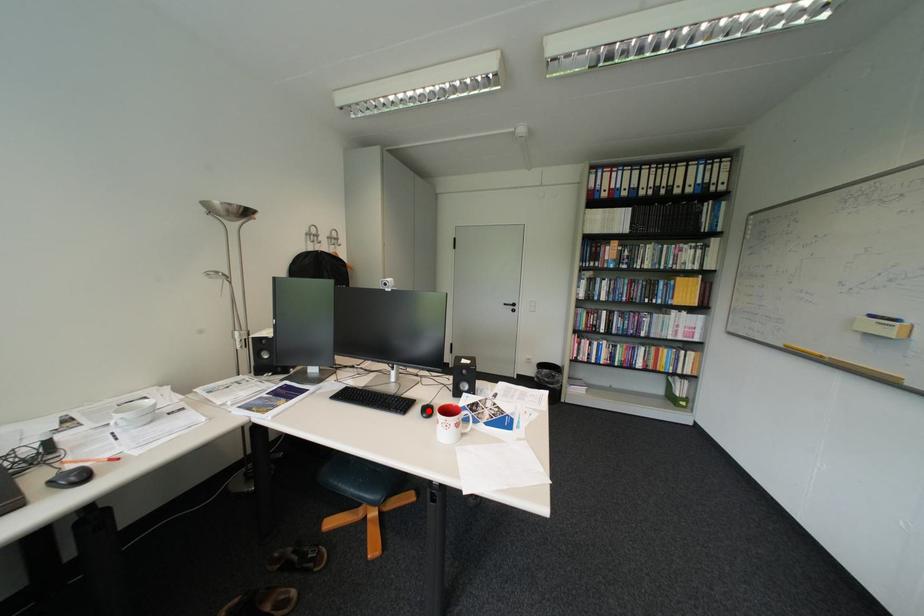
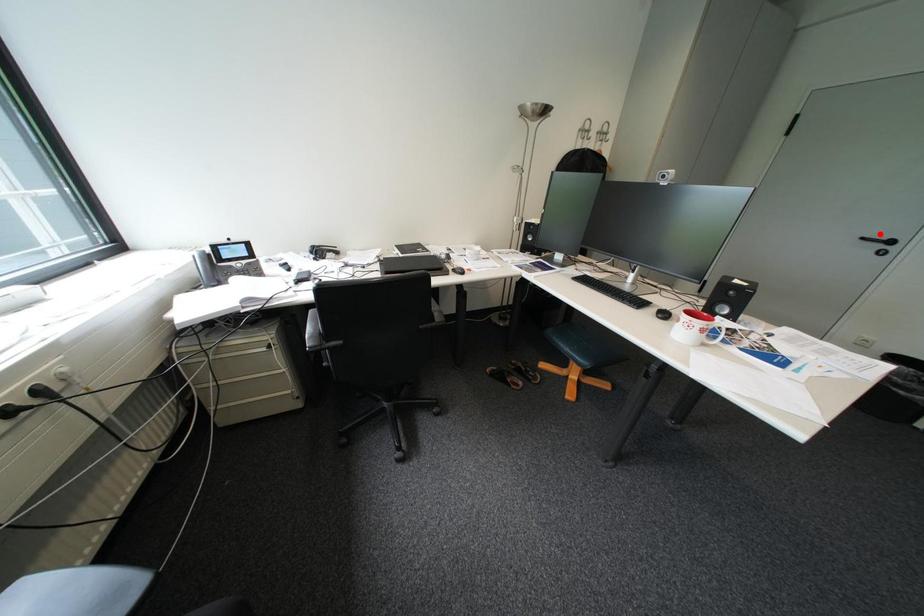
I am providing you with two images of the same scene from different viewpoints. A red point is marked on the first image and another point is marked on the second image. Is the red point in image1 aligned with the point shown in image2?

No